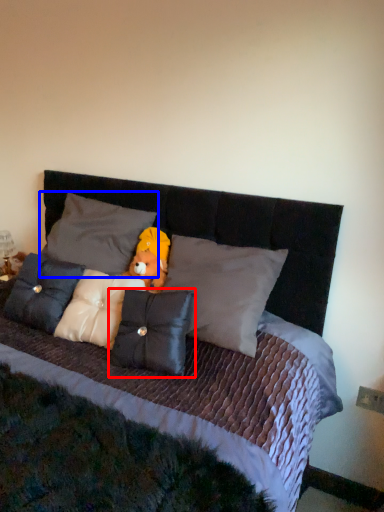
Question: Which object is closer to the camera taking this photo, pillow (highlighted by a red box) or pillow (highlighted by a blue box)?

Choices:
 (A) pillow
 (B) pillow

Answer: (A)